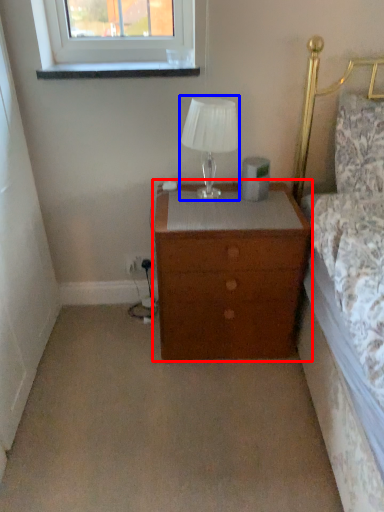
Question: Among these objects, which one is nearest to the camera, nightstand (highlighted by a red box) or table lamp (highlighted by a blue box)?

Choices:
 (A) nightstand
 (B) table lamp

Answer: (A)